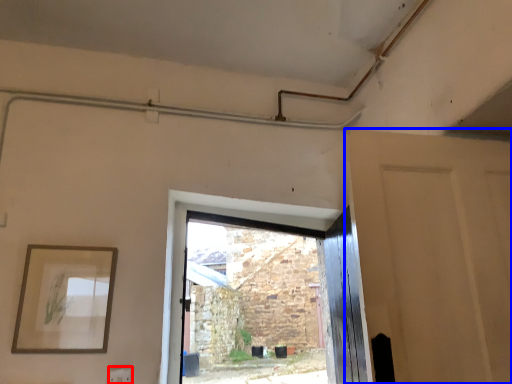
Question: Which point is closer to the camera, electric outlet (highlighted by a red box) or door (highlighted by a blue box)?

Choices:
 (A) electric outlet
 (B) door

Answer: (B)